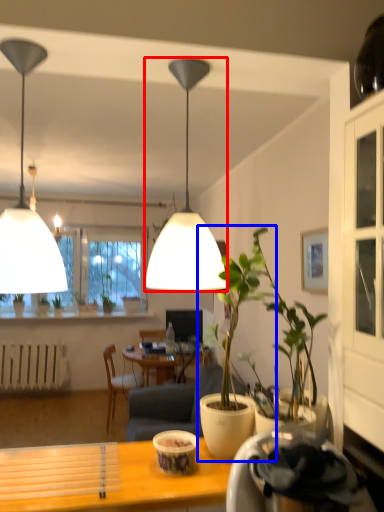
Question: Which object is further to the camera taking this photo, lamp (highlighted by a red box) or houseplant (highlighted by a blue box)?

Choices:
 (A) lamp
 (B) houseplant

Answer: (A)